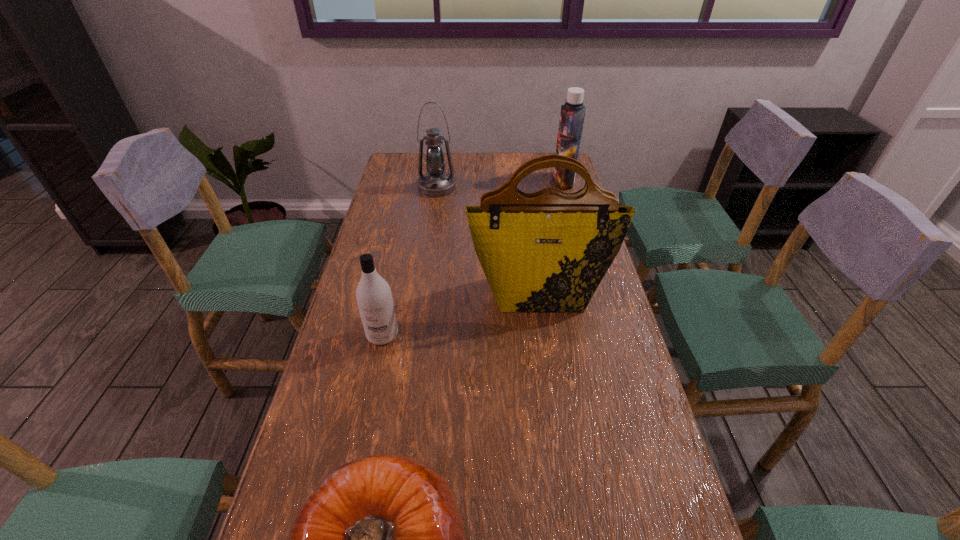
This screenshot has height=540, width=960. Find the location of `object that is at the far right corner`. object that is at the far right corner is located at coordinates pyautogui.click(x=572, y=114).

The image size is (960, 540). Find the location of `vacant space at the far edge of the desktop`. vacant space at the far edge of the desktop is located at coordinates (480, 166).

Find the location of a particular element. This screenshot has width=960, height=540. free location at the left edge of the desktop is located at coordinates (400, 221).

Identify the location of vacant region at the right edge of the desktop. (605, 392).

The image size is (960, 540). Find the location of `vacant space at the far left corner of the desktop`. vacant space at the far left corner of the desktop is located at coordinates click(x=400, y=179).

You are a GUI agent. You are given a task and a screenshot of the screen. Output one action in this format:
    pyautogui.click(x=<x>, y=<y>)
    Task: Click on the free point between the farther shampoo and the nearer shampoo
    The height and width of the screenshot is (540, 960).
    Given the screenshot: What is the action you would take?
    pyautogui.click(x=473, y=258)

I want to click on vacant point located between the right shampoo and the shorter shampoo, so click(473, 258).

The width and height of the screenshot is (960, 540). What are the coordinates of `vacant area between the right shampoo and the oil lamp` in the screenshot? It's located at (500, 184).

In order to click on free point between the taller shampoo and the left shampoo in this screenshot , I will do pos(473,258).

This screenshot has width=960, height=540. I want to click on free spot between the fourth tallest object and the oil lamp, so click(410, 261).